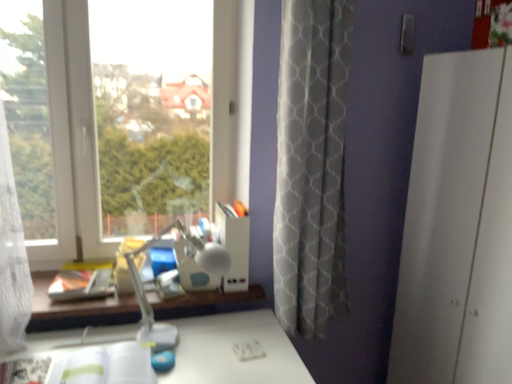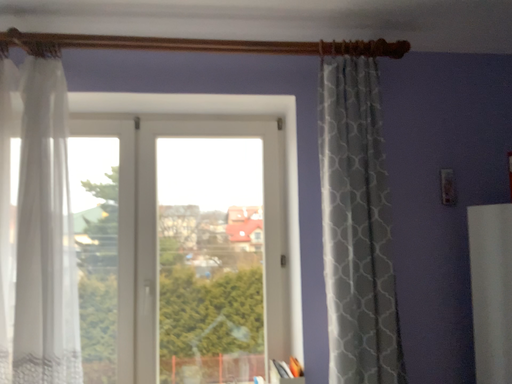
Question: Which way did the camera rotate in the video?

Choices:
 (A) rotated right
 (B) rotated left

Answer: (B)